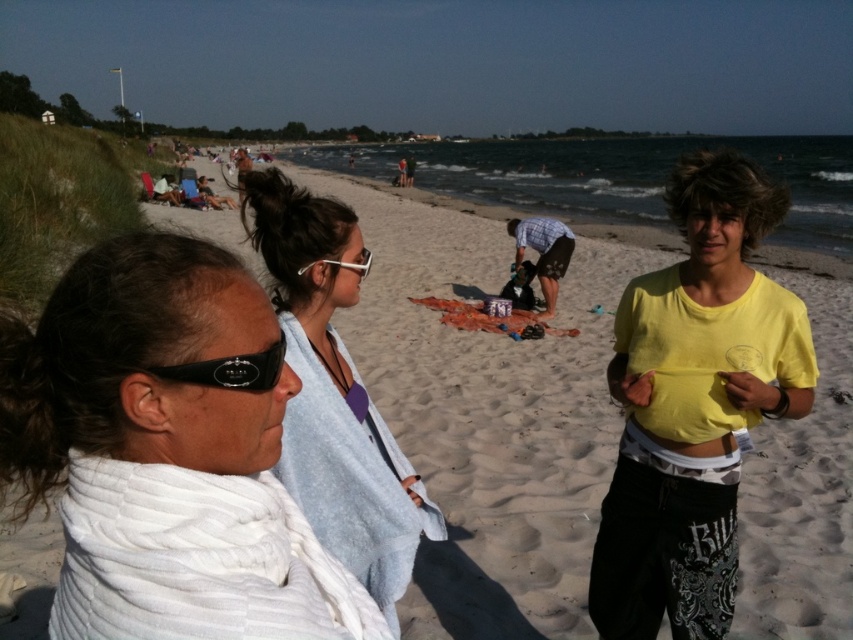
Question: Based on their relative distances, which object is farther from the black rubber goggles at left?

Choices:
 (A) white towel at left
 (B) white towel at center

Answer: (B)

Question: Can you confirm if white towel at left is bigger than black rubber goggles at left?

Choices:
 (A) no
 (B) yes

Answer: (B)

Question: Which is farther from the white towel at left?

Choices:
 (A) white towel at center
 (B) black rubber goggles at left

Answer: (A)

Question: Which point is closer to the camera?

Choices:
 (A) (409, 557)
 (B) (279, 360)
 (C) (189, 316)

Answer: (C)

Question: Does white towel at center come in front of black rubber goggles at left?

Choices:
 (A) yes
 (B) no

Answer: (B)

Question: Is white towel at center below black rubber goggles at left?

Choices:
 (A) yes
 (B) no

Answer: (A)